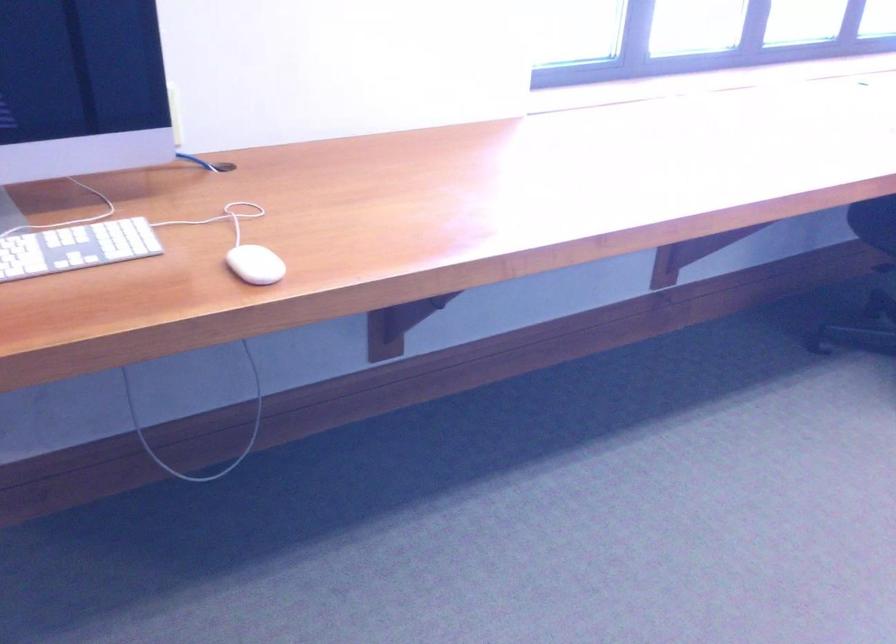
At what (x,y) coordinates should I click in order to perform the action: click on keyboard key. Please return your answer as a coordinate pair (x, y). This screenshot has width=896, height=644. Looking at the image, I should click on [75, 247].